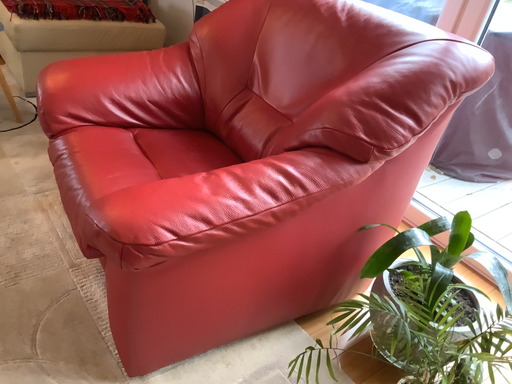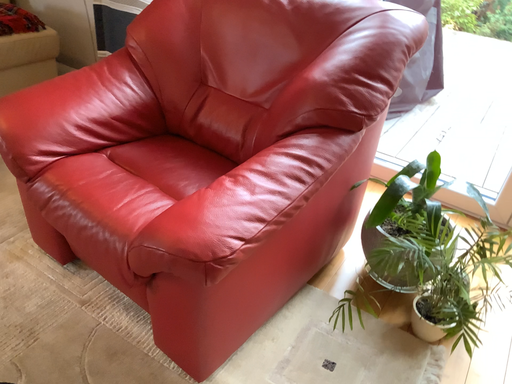
Question: Which way did the camera rotate in the video?

Choices:
 (A) rotated right
 (B) rotated left

Answer: (A)